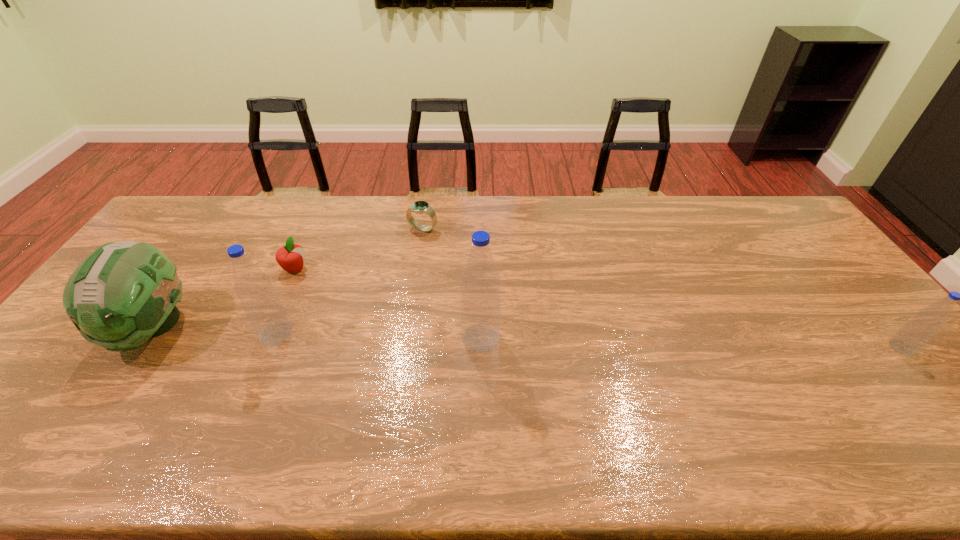
At what (x,y) coordinates should I click in order to perform the action: click on free space between the watch and the apple. Please return your answer as a coordinate pair (x, y). Looking at the image, I should click on (359, 249).

I want to click on vacant area that lies between the watch and the leftmost water bottle, so click(x=349, y=281).

Select which object is the second closest to the rightmost water bottle. Please provide its 2D coordinates. Your answer should be formatted as a tuple, i.e. [(x, y)], where the tuple contains the x and y coordinates of a point satisfying the conditions above.

[(420, 207)]

Where is `the fifth closest object to the second water bottle from left to right`? This screenshot has height=540, width=960. the fifth closest object to the second water bottle from left to right is located at coordinates (918, 331).

You are a GUI agent. You are given a task and a screenshot of the screen. Output one action in this format:
    pyautogui.click(x=<x>, y=<y>)
    Task: Click on the water bottle that is the closest to the fifth object from left to right
    The height and width of the screenshot is (540, 960).
    Given the screenshot: What is the action you would take?
    pyautogui.click(x=261, y=304)

Identify which water bottle is the closest to the second object from right to left. Please provide its 2D coordinates. Your answer should be formatted as a tuple, i.e. [(x, y)], where the tuple contains the x and y coordinates of a point satisfying the conditions above.

[(261, 304)]

Locate an element on the screen. blank area in the image that satisfies the following two spatial constraints: 1. on the front side of the second water bottle from right to left; 2. on the left side of the leftmost water bottle is located at coordinates (274, 338).

Where is `free space in the image that satisfies the following two spatial constraints: 1. on the back side of the second shortest water bottle; 2. on the left side of the third object from right to left`? Image resolution: width=960 pixels, height=540 pixels. free space in the image that satisfies the following two spatial constraints: 1. on the back side of the second shortest water bottle; 2. on the left side of the third object from right to left is located at coordinates (320, 229).

This screenshot has width=960, height=540. Identify the location of free point that satisfies the following two spatial constraints: 1. on the front side of the second water bottle from left to right; 2. on the right side of the fifth nearest object. (265, 338).

Where is `vacant area in the image that satisfies the following two spatial constraints: 1. on the visor of the leftmost object; 2. on the right side of the second water bottle from right to left`? The height and width of the screenshot is (540, 960). vacant area in the image that satisfies the following two spatial constraints: 1. on the visor of the leftmost object; 2. on the right side of the second water bottle from right to left is located at coordinates (146, 338).